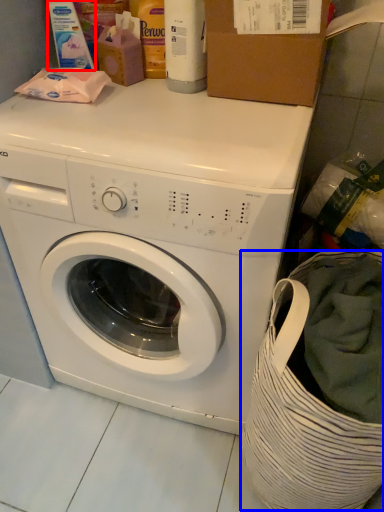
Question: Which object appears farthest to the camera in this image, cleaning product (highlighted by a red box) or laundry basket (highlighted by a blue box)?

Choices:
 (A) cleaning product
 (B) laundry basket

Answer: (A)